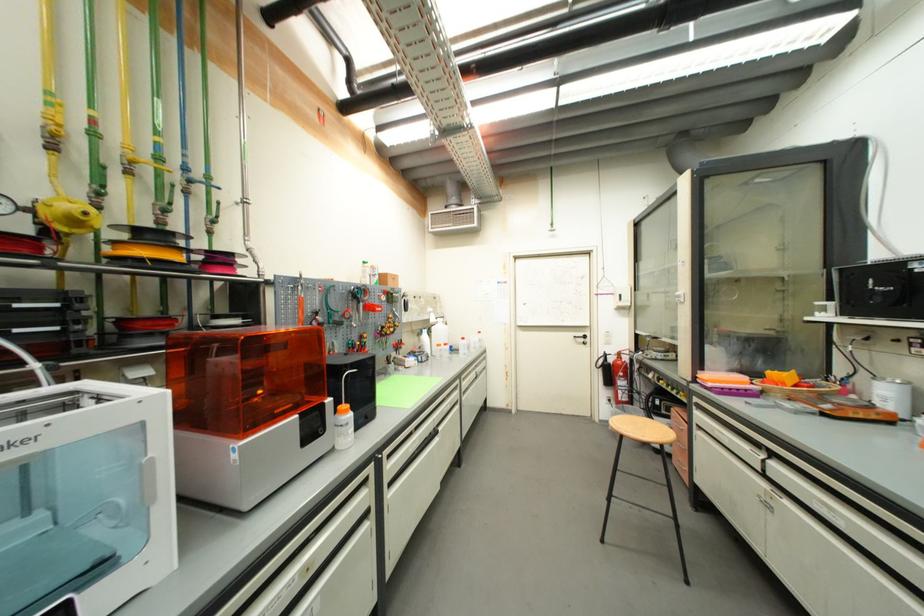
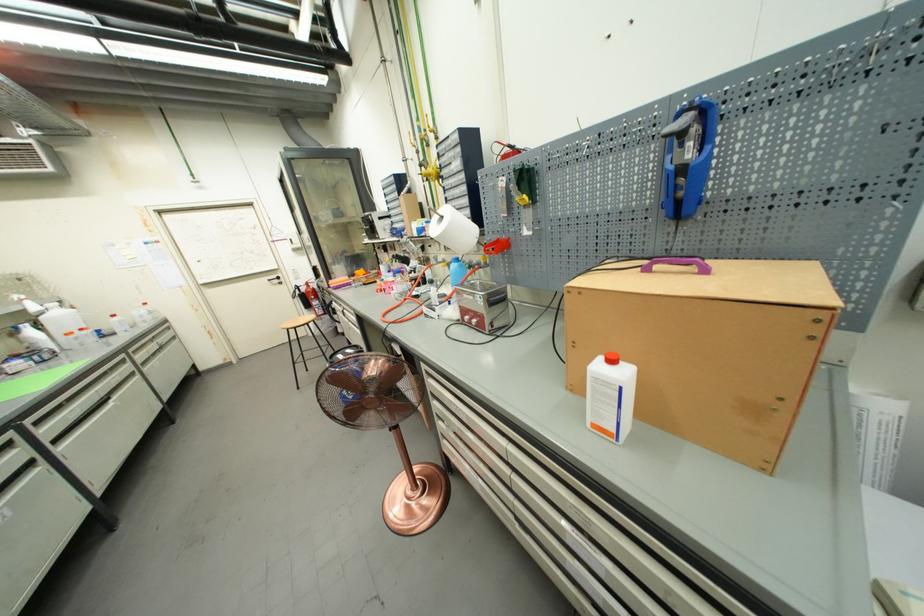
Find the pixel in the second image that matches [640,293] in the first image.

(306, 237)